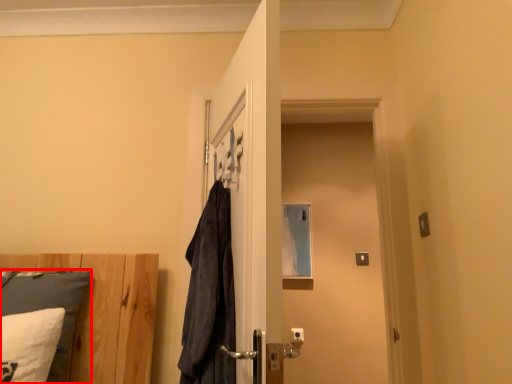
Question: Where is pillow (annotated by the red box) located in relation to screen door in the image?

Choices:
 (A) right
 (B) left

Answer: (B)